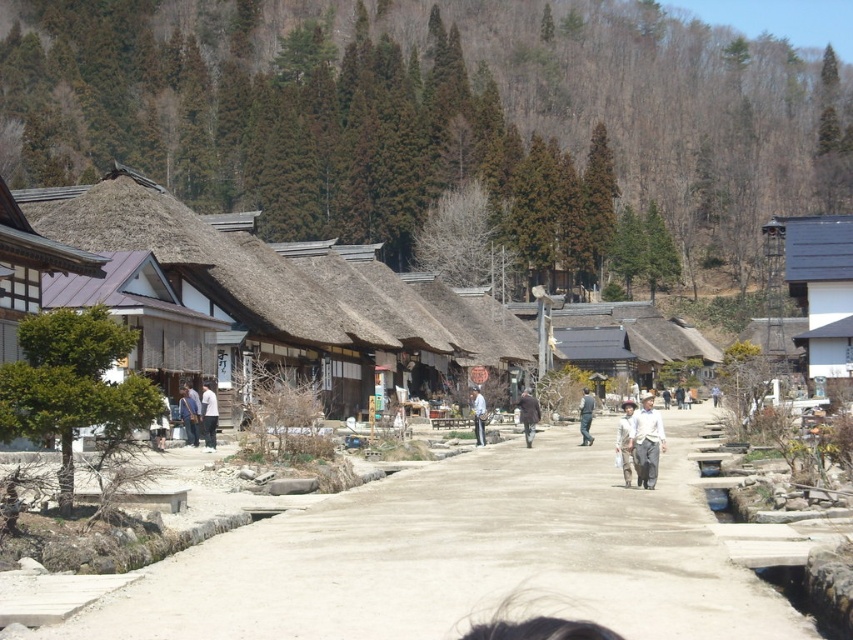
You are standing at the starting point of the unpaved road in the village scene. There are two points marked on the road ahead of you at coordinates point (795, 275) and point (628, 440). Which point is closer to your current position?

Point (628, 440) is closer to your current position because it is less far from the camera compared to point (795, 275), which is further away.

Looking at this image, you are a traveler carrying a backpack and need to decide which item to place on the ground first between the white cotton shirt at center and the dark brown leather jacket at center. Based on their widths, which one should you place first to ensure the wider item is kept on top?

The white cotton shirt at center has a smaller width than the dark brown leather jacket at center. To keep the wider dark brown leather jacket at center on top, you should place the white cotton shirt at center first.